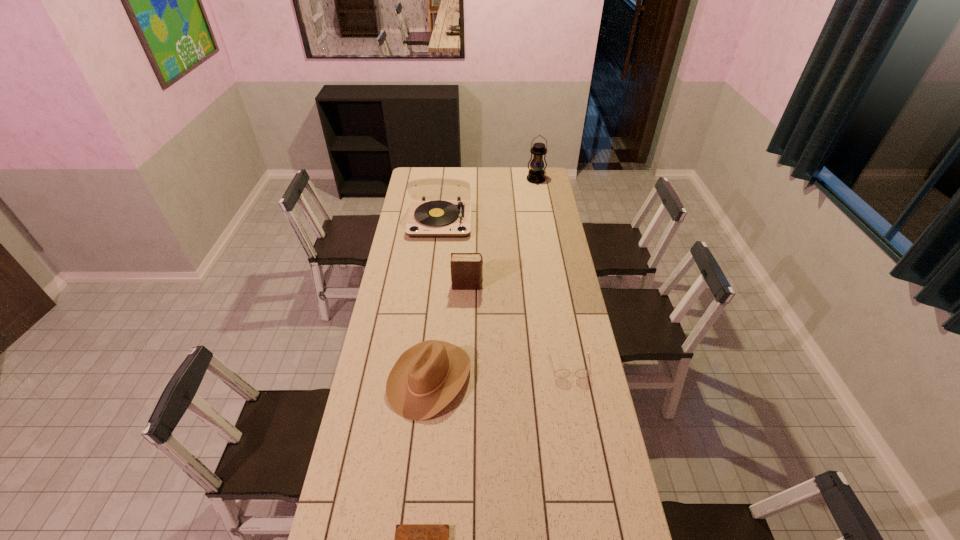
The width and height of the screenshot is (960, 540). What are the coordinates of `the farthest object` in the screenshot? It's located at (536, 175).

The height and width of the screenshot is (540, 960). In order to click on the second farthest object in this screenshot , I will do `click(427, 219)`.

Identify the location of the farther diary. (466, 268).

Locate an element on the screen. the third tallest object is located at coordinates (466, 268).

Identify the location of cowboy hat. This screenshot has height=540, width=960. (426, 377).

I want to click on spectacles, so click(561, 373).

Identify a few places in vacant region located 0.170m above the farthest object, indicating its light source. Please provide its 2D coordinates. Your answer should be formatted as a tuple, i.e. [(x, y)], where the tuple contains the x and y coordinates of a point satisfying the conditions above.

[(540, 200)]

Identify the location of free region located 0.390m with the tonearm facing the front of the record player. (432, 292).

I want to click on vacant space located 0.120m on the spine side of the taller diary, so click(x=509, y=286).

The width and height of the screenshot is (960, 540). I want to click on free spot located on the left of the fourth tallest object, so click(x=372, y=379).